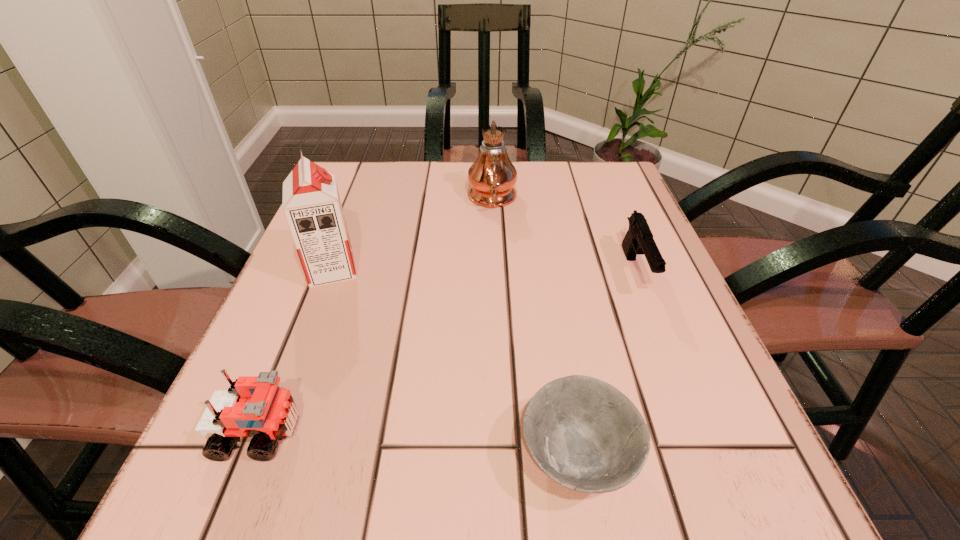
You are a GUI agent. You are given a task and a screenshot of the screen. Output one action in this format:
    pyautogui.click(x=<x>, y=<y>)
    Task: Click on the vacant region that satisfies the following two spatial constraints: 1. on the front-facing side of the pistol; 2. on the front-facing side of the Lego
    This screenshot has width=960, height=540.
    Given the screenshot: What is the action you would take?
    pyautogui.click(x=699, y=432)

At what (x,y) coordinates should I click in order to perform the action: click on free spot that satisfies the following two spatial constraints: 1. on the front-facing side of the pistol; 2. on the front-facing side of the Lego. Please return your answer as a coordinate pair (x, y). The width and height of the screenshot is (960, 540). Looking at the image, I should click on coord(699,432).